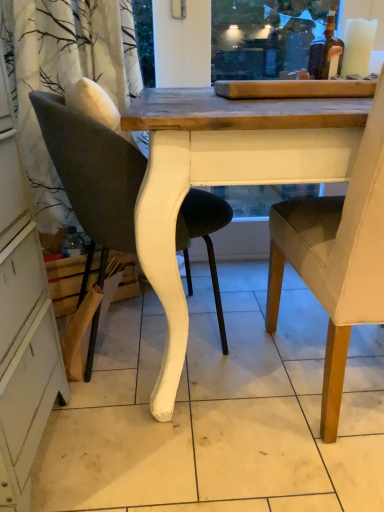
The width and height of the screenshot is (384, 512). In order to click on vacant area to the left of light brown fabric chair at right, which is the 1th chair in right-to-left order in this screenshot , I will do (x=198, y=423).